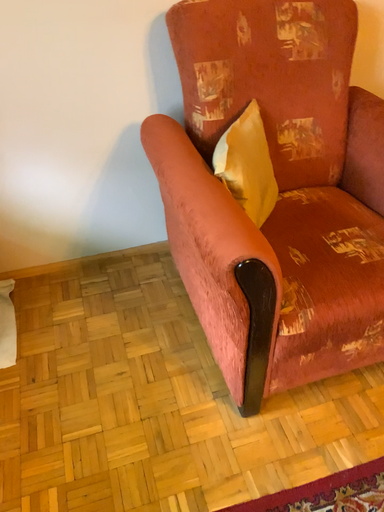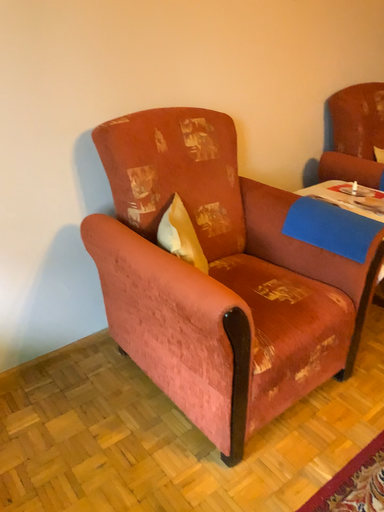
Question: How did the camera likely rotate when shooting the video?

Choices:
 (A) rotated downward
 (B) rotated upward

Answer: (B)